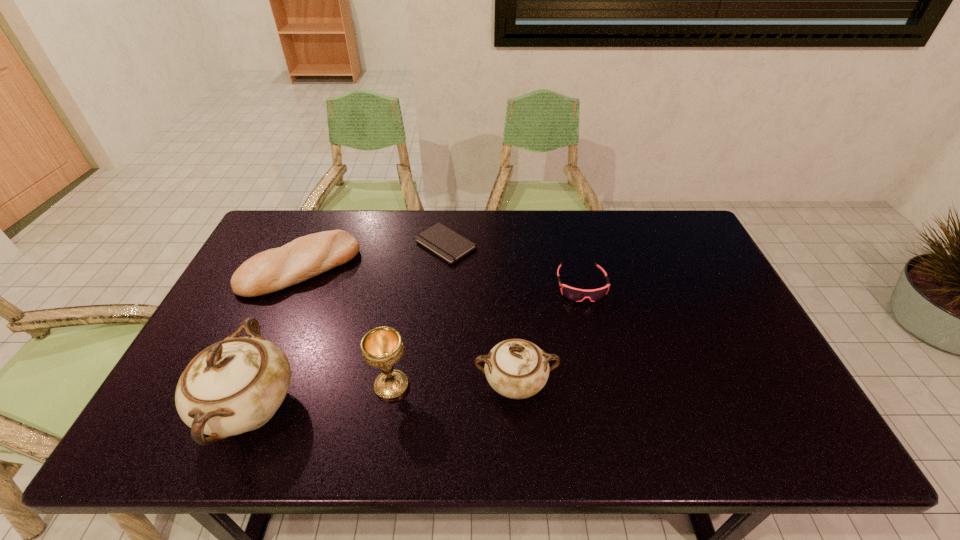
Locate an element on the screen. This screenshot has height=540, width=960. free spot between the goggles and the checkbook is located at coordinates (514, 265).

The height and width of the screenshot is (540, 960). In order to click on vacant area that lies between the checkbook and the tallest object in this screenshot , I will do `click(348, 326)`.

Find the location of a particular element. This screenshot has width=960, height=540. free space that is in between the shortest object and the shorter chinaware is located at coordinates (480, 314).

Locate an element on the screen. This screenshot has height=540, width=960. free space between the tallest object and the rightmost object is located at coordinates (416, 347).

Locate an element on the screen. empty space that is in between the bread and the shorter chinaware is located at coordinates (408, 326).

The image size is (960, 540). Identify the location of unoccupied position between the right chinaware and the chalice. (453, 385).

Select which object is the closest to the left chinaware. Please provide its 2D coordinates. Your answer should be formatted as a tuple, i.e. [(x, y)], where the tuple contains the x and y coordinates of a point satisfying the conditions above.

[(381, 347)]

Identify the location of the fourth closest object to the checkbook. This screenshot has height=540, width=960. (381, 347).

The image size is (960, 540). Find the location of `vacant space that satisfies the following two spatial constraints: 1. on the front side of the fourth tallest object; 2. on the right side of the chalice`. vacant space that satisfies the following two spatial constraints: 1. on the front side of the fourth tallest object; 2. on the right side of the chalice is located at coordinates (249, 386).

At what (x,y) coordinates should I click in order to perform the action: click on free location that satisfies the following two spatial constraints: 1. on the front side of the bread; 2. on the left side of the shorter chinaware. Please return your answer as a coordinate pair (x, y). This screenshot has width=960, height=540. Looking at the image, I should click on (249, 384).